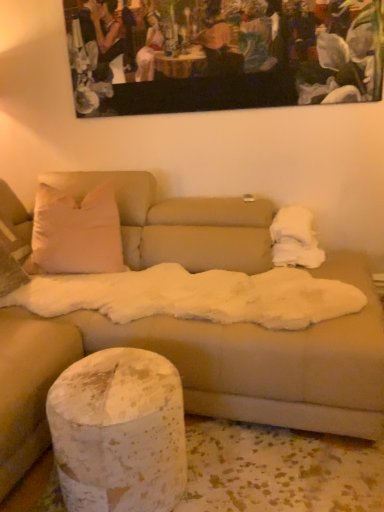
Question: Is white fluffy blanket at upper right positioned beyond the bounds of wooden painting at upper center?

Choices:
 (A) no
 (B) yes

Answer: (B)

Question: Is white fluffy blanket at upper right beside wooden painting at upper center?

Choices:
 (A) yes
 (B) no

Answer: (B)

Question: Considering the relative sizes of white fluffy blanket at upper right and wooden painting at upper center in the image provided, is white fluffy blanket at upper right shorter than wooden painting at upper center?

Choices:
 (A) no
 (B) yes

Answer: (B)

Question: Considering the relative positions of white fluffy blanket at upper right and wooden painting at upper center in the image provided, is white fluffy blanket at upper right to the left of wooden painting at upper center from the viewer's perspective?

Choices:
 (A) no
 (B) yes

Answer: (A)

Question: From the image's perspective, is white fluffy blanket at upper right under wooden painting at upper center?

Choices:
 (A) no
 (B) yes

Answer: (B)

Question: Considering the relative sizes of white fluffy blanket at upper right and wooden painting at upper center in the image provided, is white fluffy blanket at upper right smaller than wooden painting at upper center?

Choices:
 (A) no
 (B) yes

Answer: (B)

Question: Is wooden painting at upper center positioned beyond the bounds of speckled white cylinder at lower left?

Choices:
 (A) yes
 (B) no

Answer: (A)

Question: Is wooden painting at upper center facing towards speckled white cylinder at lower left?

Choices:
 (A) no
 (B) yes

Answer: (A)

Question: Is wooden painting at upper center next to speckled white cylinder at lower left?

Choices:
 (A) yes
 (B) no

Answer: (B)

Question: Considering the relative sizes of wooden painting at upper center and speckled white cylinder at lower left in the image provided, is wooden painting at upper center taller than speckled white cylinder at lower left?

Choices:
 (A) no
 (B) yes

Answer: (B)

Question: Is wooden painting at upper center closer to the viewer compared to speckled white cylinder at lower left?

Choices:
 (A) no
 (B) yes

Answer: (A)

Question: Can you confirm if wooden painting at upper center is shorter than speckled white cylinder at lower left?

Choices:
 (A) yes
 (B) no

Answer: (B)

Question: Is wooden painting at upper center oriented away from white fluffy blanket at upper right?

Choices:
 (A) no
 (B) yes

Answer: (A)